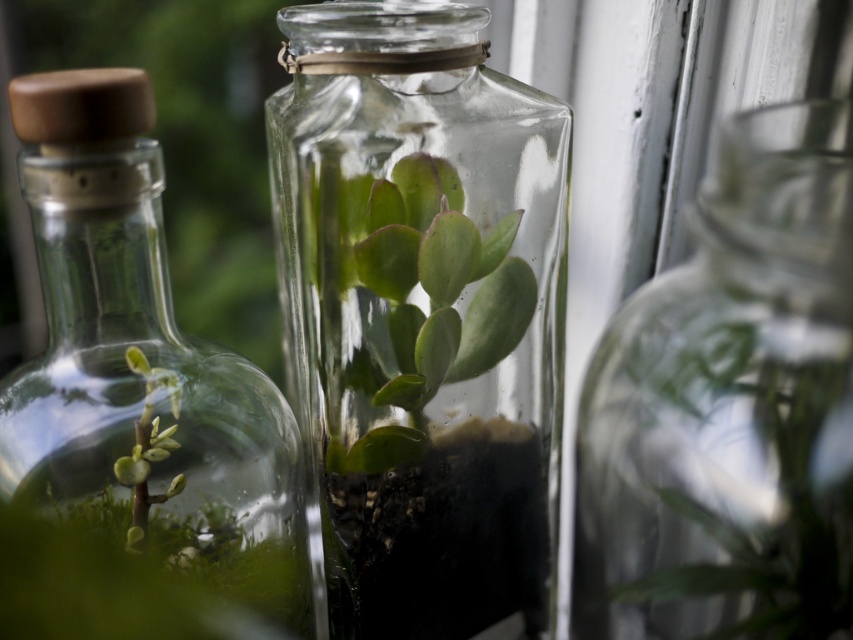
Can you confirm if transparent glass vase at center is bigger than green matte succulent at center?

Indeed, transparent glass vase at center has a larger size compared to green matte succulent at center.

Where is `transparent glass vase at center`? The height and width of the screenshot is (640, 853). transparent glass vase at center is located at coordinates (421, 314).

Is point (434, 74) farther from camera compared to point (15, 467)?

Yes, point (434, 74) is behind point (15, 467).

Who is shorter, transparent glass vase at center or clear glass bottle at left?

With less height is clear glass bottle at left.

You are a GUI agent. You are given a task and a screenshot of the screen. Output one action in this format:
    pyautogui.click(x=<x>, y=<y>)
    Task: Click on the transparent glass vase at center
    
    Given the screenshot: What is the action you would take?
    pyautogui.click(x=421, y=314)

Where is `transparent glass vase at center`? The width and height of the screenshot is (853, 640). transparent glass vase at center is located at coordinates (421, 314).

Is transparent glass vase at center below transparent glass vase at right?

Correct, transparent glass vase at center is located below transparent glass vase at right.

Is transparent glass vase at center bigger than transparent glass vase at right?

Incorrect, transparent glass vase at center is not larger than transparent glass vase at right.

Which is behind, point (430, 61) or point (792, 118)?

Point (430, 61)

At what (x,y) coordinates should I click in order to perform the action: click on transparent glass vase at center. Please return your answer as a coordinate pair (x, y). The height and width of the screenshot is (640, 853). Looking at the image, I should click on (421, 314).